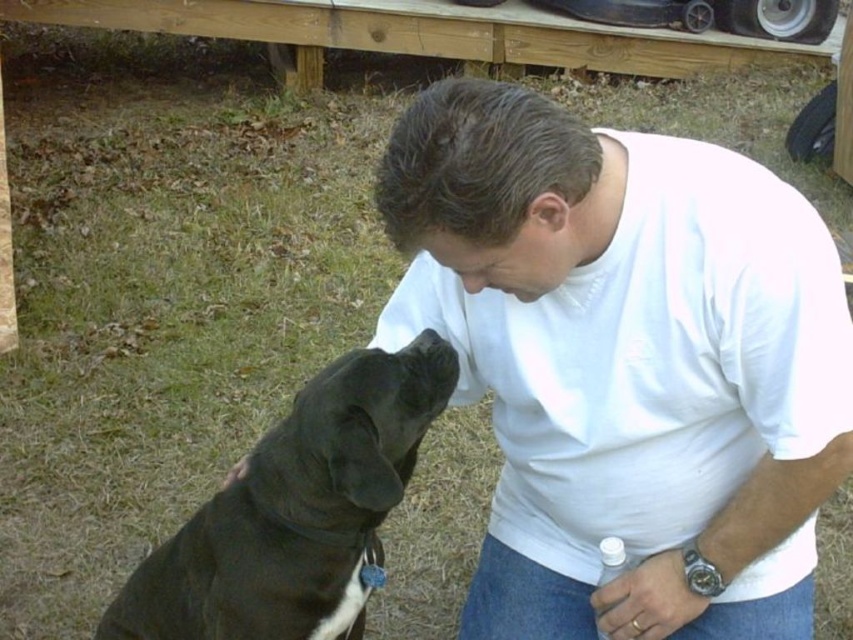
Question: Does white cotton shirt at center have a greater width compared to metallic silver watch at lower right?

Choices:
 (A) yes
 (B) no

Answer: (A)

Question: Among these objects, which one is nearest to the camera?

Choices:
 (A) black smooth dog at lower left
 (B) black matte nose at center
 (C) metallic silver watch at lower right
 (D) white cotton shirt at center

Answer: (D)

Question: Observing the image, what is the correct spatial positioning of white cotton shirt at center in reference to black smooth dog at lower left?

Choices:
 (A) left
 (B) right

Answer: (B)

Question: Is black smooth dog at lower left smaller than metallic silver watch at lower right?

Choices:
 (A) no
 (B) yes

Answer: (A)

Question: Which object is closer to the camera taking this photo?

Choices:
 (A) black matte nose at center
 (B) white cotton shirt at center
 (C) metallic silver watch at lower right
 (D) black smooth dog at lower left

Answer: (B)

Question: Estimate the real-world distances between objects in this image. Which object is farther from the black matte nose at center?

Choices:
 (A) metallic silver watch at lower right
 (B) white cotton shirt at center
 (C) black smooth dog at lower left

Answer: (A)